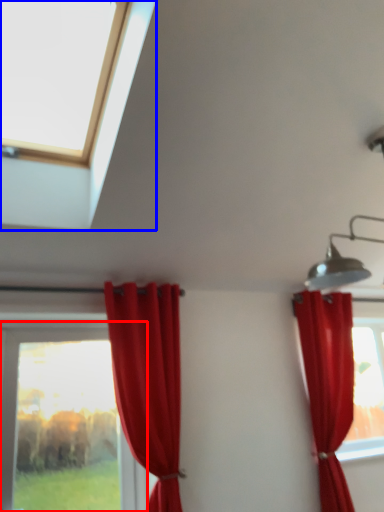
Question: Which object appears farthest to the camera in this image, window (highlighted by a red box) or window (highlighted by a blue box)?

Choices:
 (A) window
 (B) window

Answer: (A)